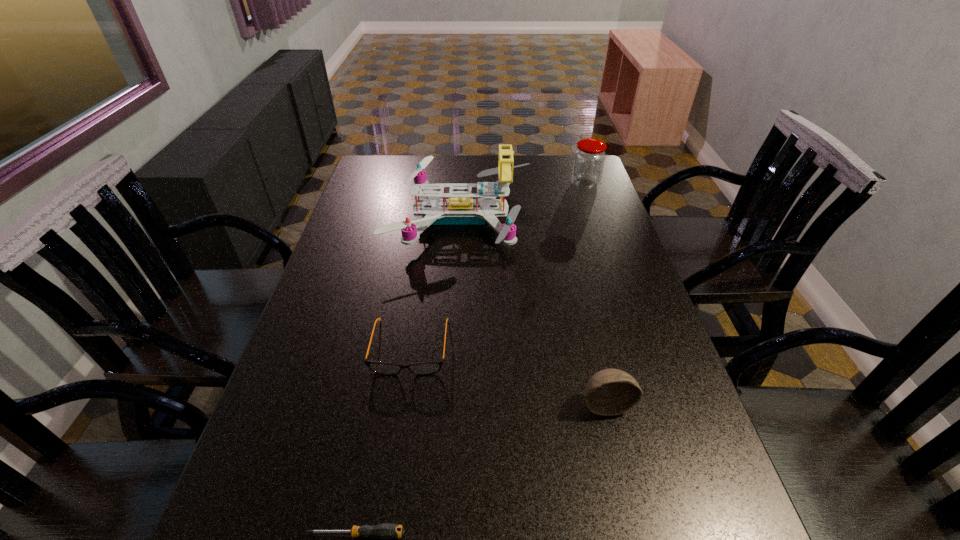
At what (x,y) coordinates should I click in order to perform the action: click on the fourth closest object relative to the rightmost object. Please return your answer as a coordinate pair (x, y). The height and width of the screenshot is (540, 960). Looking at the image, I should click on (385, 532).

This screenshot has width=960, height=540. What are the coordinates of `free location that satisfies the following two spatial constraints: 1. on the front-facing side of the second nearest object; 2. on the left side of the spectacles` in the screenshot? It's located at (402, 404).

This screenshot has height=540, width=960. In order to click on blank area in the image that satisfies the following two spatial constraints: 1. on the front-facing side of the third tallest object; 2. on the right side of the drone in this screenshot , I will do [451, 404].

Identify the location of free spot that satisfies the following two spatial constraints: 1. on the back side of the jar; 2. on the left side of the fourth object from left to right. The image size is (960, 540). (553, 184).

Identify the location of vacant point that satisfies the following two spatial constraints: 1. on the front-facing side of the drone; 2. on the front-facing side of the third nearest object. (454, 347).

This screenshot has height=540, width=960. I want to click on free spot that satisfies the following two spatial constraints: 1. on the front-facing side of the drone; 2. on the front-facing side of the second shortest object, so click(454, 347).

Where is `free spot that satisfies the following two spatial constraints: 1. on the front-facing side of the drone; 2. on the front-facing side of the third farthest object`? This screenshot has height=540, width=960. free spot that satisfies the following two spatial constraints: 1. on the front-facing side of the drone; 2. on the front-facing side of the third farthest object is located at coordinates (454, 347).

At what (x,y) coordinates should I click in order to perform the action: click on vacant space that satisfies the following two spatial constraints: 1. on the front-facing side of the fourth object from left to right; 2. on the right side of the third nearest object. Please return your answer as a coordinate pair (x, y). Looking at the image, I should click on (402, 404).

Find the location of `free spot that satisfies the following two spatial constraints: 1. on the front-facing side of the fourth object from left to right; 2. on the left side of the spectacles`. free spot that satisfies the following two spatial constraints: 1. on the front-facing side of the fourth object from left to right; 2. on the left side of the spectacles is located at coordinates (402, 404).